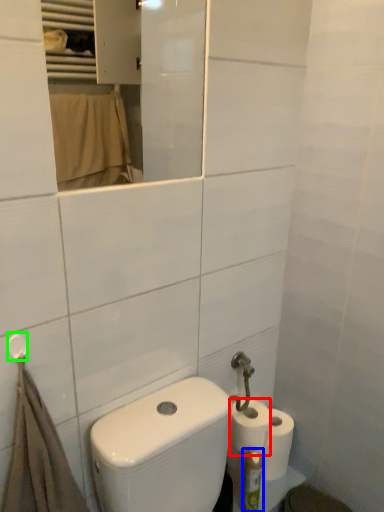
Question: Which object is the farthest from toilet paper (highlighted by a red box)? Choose among these: toiletry (highlighted by a blue box) or towel bar (highlighted by a green box).

Choices:
 (A) toiletry
 (B) towel bar

Answer: (B)